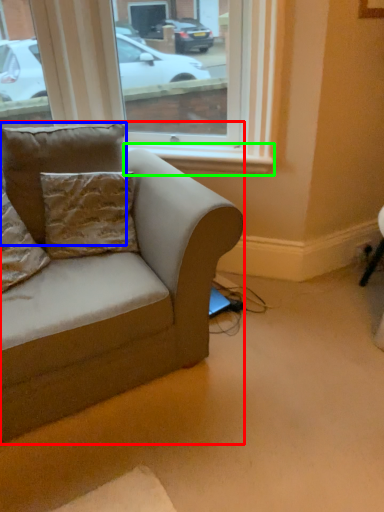
Question: Which object is the farthest from studio couch (highlighted by a red box)? Choose among these: pillow (highlighted by a blue box) or window sill (highlighted by a green box).

Choices:
 (A) pillow
 (B) window sill

Answer: (B)